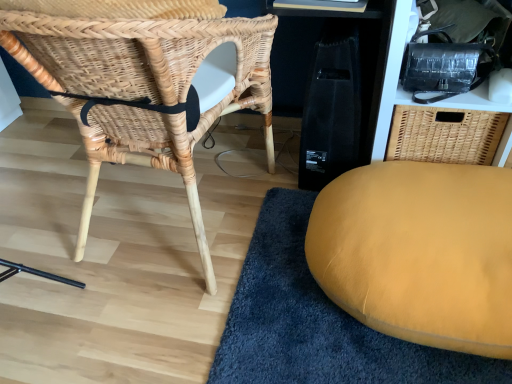
In order to click on free space that is to the left of natural woven chair at left in this screenshot , I will do `click(52, 180)`.